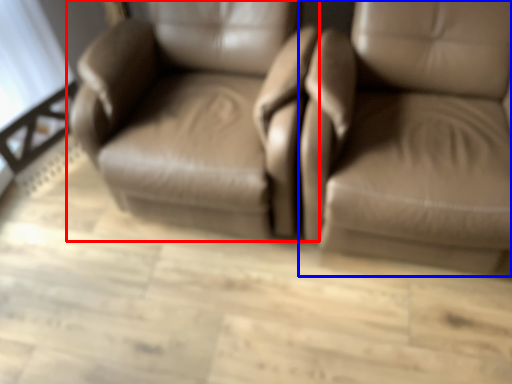
Question: Which object is further to the camera taking this photo, chair (highlighted by a red box) or chair (highlighted by a blue box)?

Choices:
 (A) chair
 (B) chair

Answer: (A)